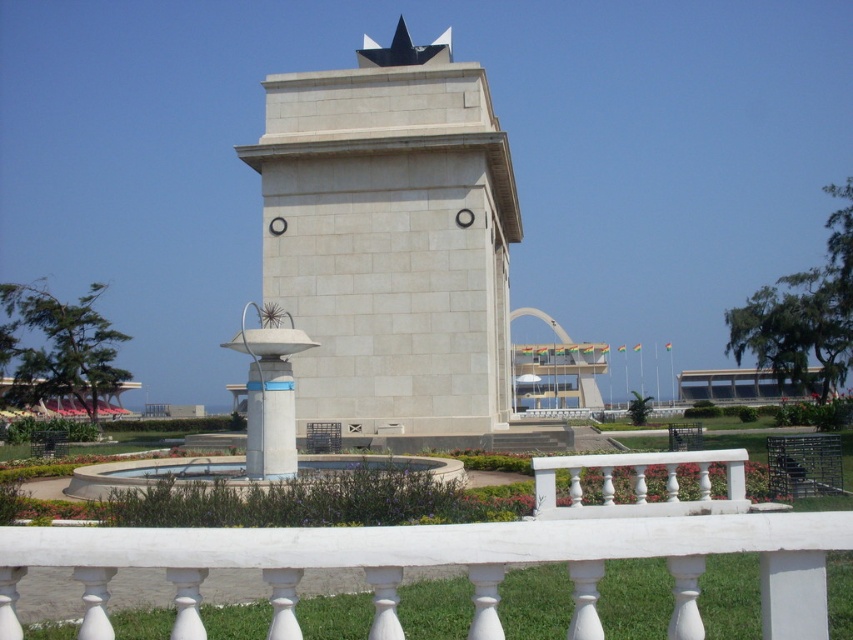
You are a visitor standing at the edge of the park, looking towards the monument. You notice the white marble balustrade at lower center and the blue glossy pedestal at center. Which object is shorter in height?

The white marble balustrade at lower center is not as tall as the blue glossy pedestal at center, so the white marble balustrade at lower center is shorter in height.

You are standing in front of the monument and want to place a small statue on the closest object to you. Which object should you choose between the white stone tower at center and the blue glossy pedestal at center?

The white stone tower at center is closer to you because the blue glossy pedestal at center is behind it. Therefore, you should place the statue on the white stone tower at center.

You are a visitor standing at the edge of the park, looking towards the monument. You see the white stone tower at center and the white marble balustrade at lower center. Which of these two objects appears bigger to you?

The white stone tower at center appears bigger than the white marble balustrade at lower center because it is larger in size.